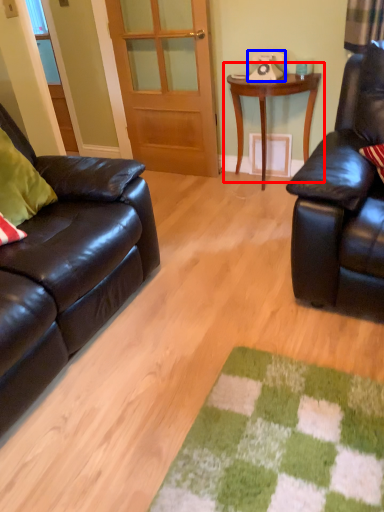
Question: Among these objects, which one is farthest to the camera, table (highlighted by a red box) or corded phone (highlighted by a blue box)?

Choices:
 (A) table
 (B) corded phone

Answer: (B)